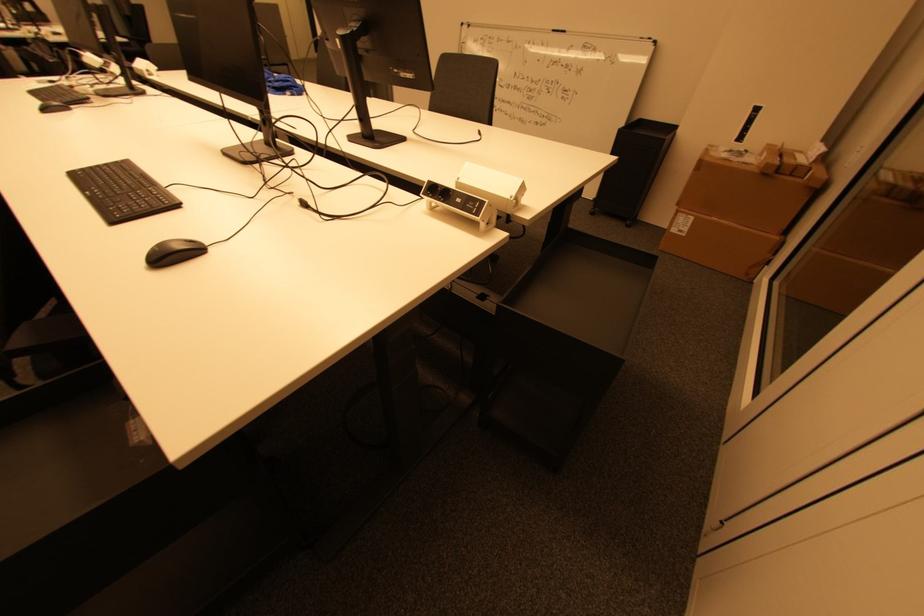
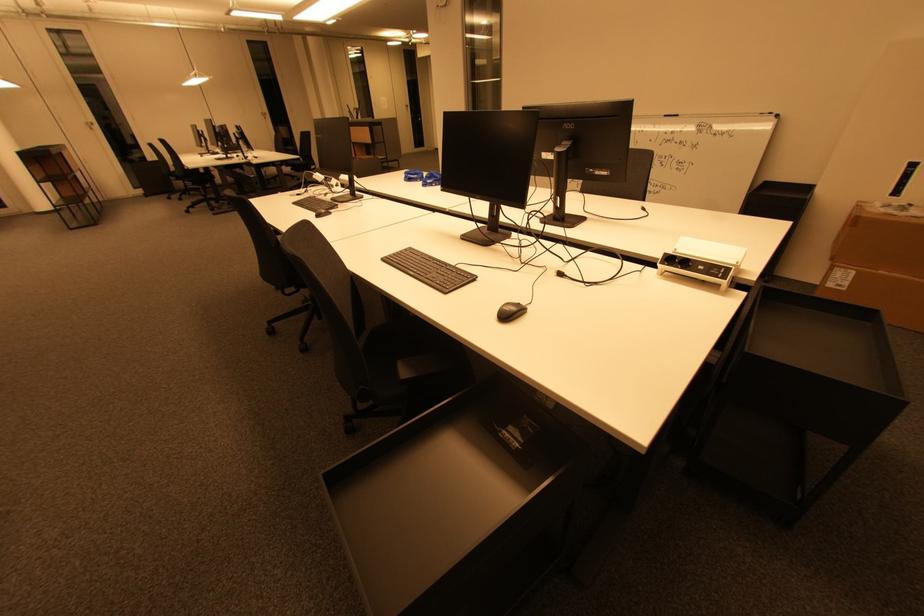
In a continuous first-person perspective shot, in which direction is the camera moving?

The cameraman moved toward left, backward.